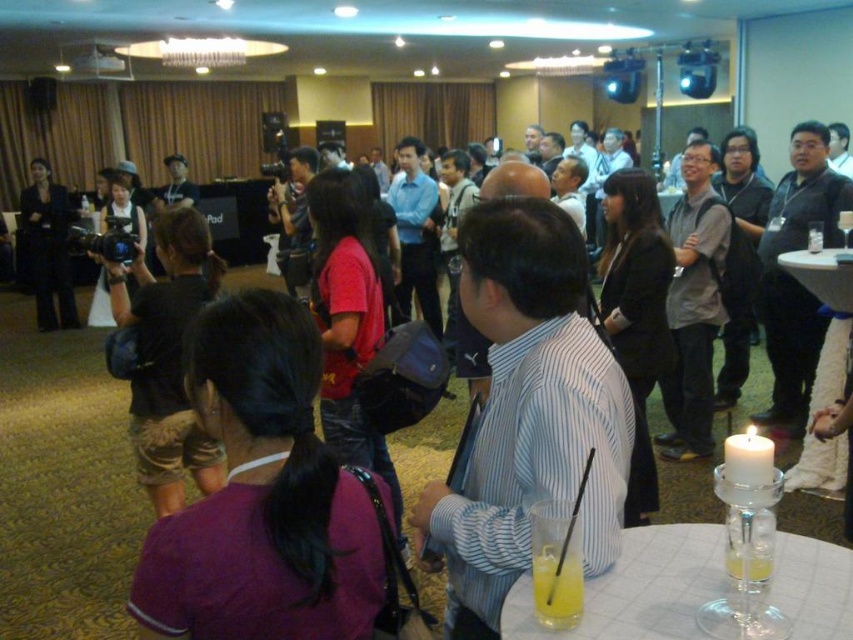
You are a photographer standing at the back of the room. You want to take a photo that includes both the striped cotton shirt at center and the clear plastic cup at lower center. Which object should you ensure is closer to the camera to avoid it being too small in the photo?

The striped cotton shirt at center has a greater height compared to the clear plastic cup at lower center. To ensure both are visible and not too small, you should position the striped cotton shirt at center closer to the camera since it is taller and might otherwise appear smaller if farther away.

You are at a social event and need to locate two individuals based on their clothing. There is a person wearing a purple fabric shirt at lower left and another in a matte black suit at left. Which one is positioned more to the right side of the scene?

The purple fabric shirt at lower left is positioned to the right of the matte black suit at left, so the person in the purple fabric shirt at lower left is more to the right side of the scene.